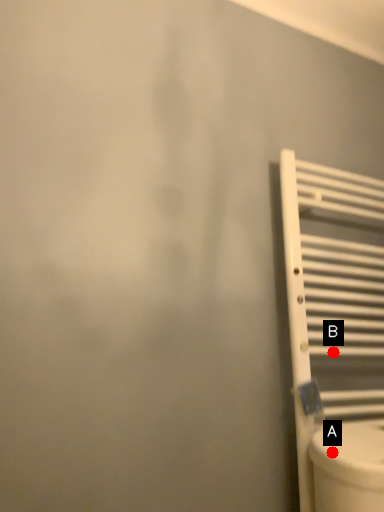
Question: Two points are circled on the image, labeled by A and B beside each circle. Which of the following is the farthest from the observer?

Choices:
 (A) A is further
 (B) B is further

Answer: (B)